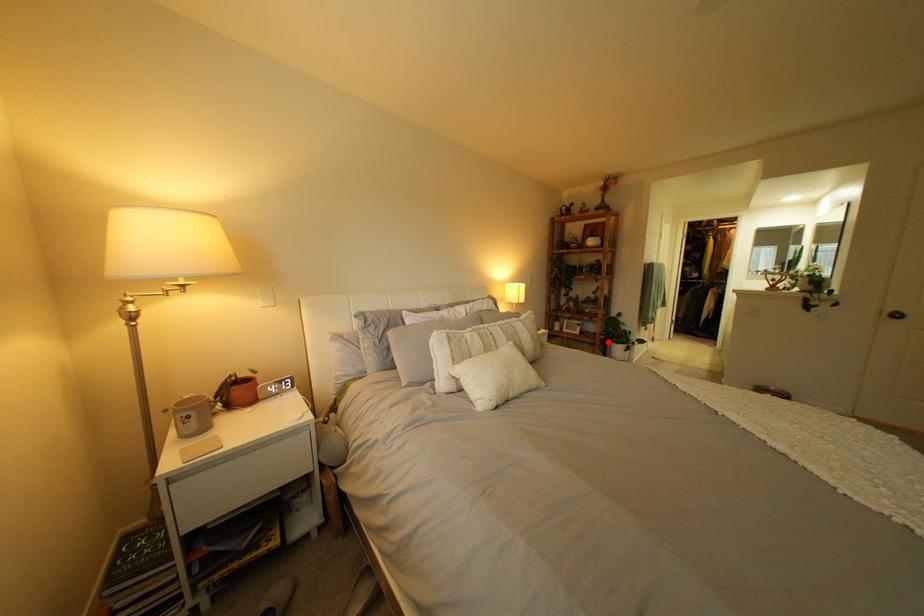
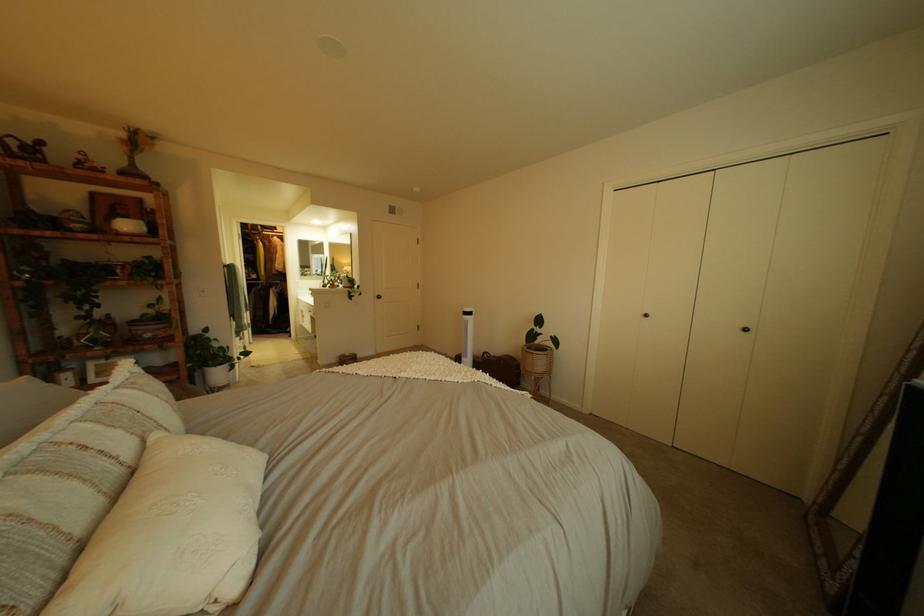
In the second image, find the point that corresponds to the highlighted location in the first image.

(189, 379)